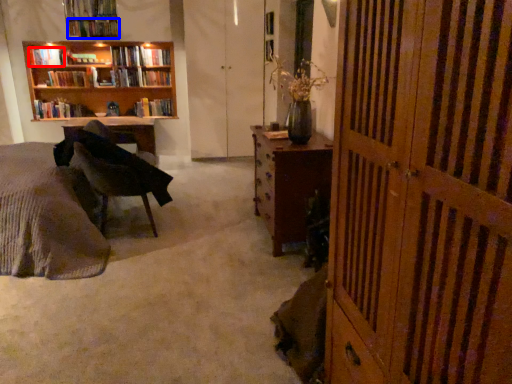
Question: Which object is further to the camera taking this photo, book (highlighted by a red box) or book (highlighted by a blue box)?

Choices:
 (A) book
 (B) book

Answer: (A)